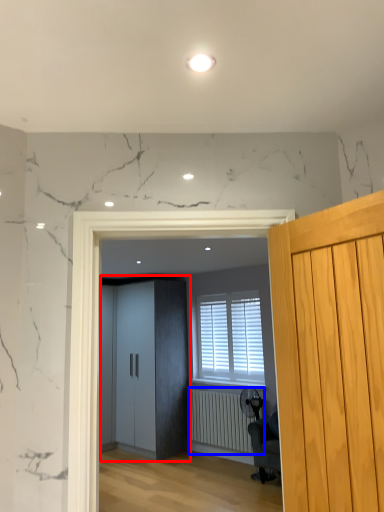
Question: Which of the following is the closest to the observer, elevator (highlighted by a red box) or radiator (highlighted by a blue box)?

Choices:
 (A) elevator
 (B) radiator

Answer: (B)